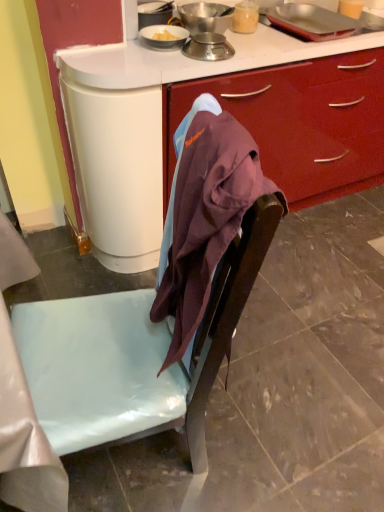
Locate an element on the screen. The width and height of the screenshot is (384, 512). metallic silver scale at upper center, placed as the 3th kitchen appliance when sorted from right to left is located at coordinates tap(205, 17).

What do you see at coordinates (133, 355) in the screenshot?
I see `matte brown chair at center` at bounding box center [133, 355].

Find the location of a particular element. Image resolution: width=384 pixels, height=512 pixels. metallic silver scale at upper center, which appears as the 2th kitchen appliance when viewed from the left is located at coordinates (208, 47).

The height and width of the screenshot is (512, 384). Describe the element at coordinates (311, 21) in the screenshot. I see `metallic silver tray at upper right, which appears as the first kitchen appliance when viewed from the right` at that location.

The height and width of the screenshot is (512, 384). I want to click on metallic silver scale at upper center, the first kitchen appliance in the left-to-right sequence, so click(205, 17).

Can you confirm if metallic silver scale at upper center, which appears as the 2th kitchen appliance when viewed from the left, is wider than metallic silver scale at upper center, the first kitchen appliance in the left-to-right sequence?

Incorrect, the width of metallic silver scale at upper center, which appears as the 2th kitchen appliance when viewed from the left, does not surpass that of metallic silver scale at upper center, the first kitchen appliance in the left-to-right sequence.

From the image's perspective, is metallic silver scale at upper center, which appears as the 2th kitchen appliance when viewed from the left, beneath metallic silver scale at upper center, the first kitchen appliance in the left-to-right sequence?

Correct, metallic silver scale at upper center, which appears as the 2th kitchen appliance when viewed from the left, appears lower than metallic silver scale at upper center, the first kitchen appliance in the left-to-right sequence, in the image.

Would you say metallic silver scale at upper center, placed as the 3th kitchen appliance when sorted from right to left, is part of metallic silver scale at upper center, the 2th kitchen appliance positioned from the right,'s contents?

No, metallic silver scale at upper center, placed as the 3th kitchen appliance when sorted from right to left, is located outside of metallic silver scale at upper center, the 2th kitchen appliance positioned from the right.

Who is smaller, metallic silver scale at upper center, which appears as the 2th kitchen appliance when viewed from the left, or metallic silver scale at upper center, the first kitchen appliance in the left-to-right sequence?

metallic silver scale at upper center, which appears as the 2th kitchen appliance when viewed from the left, is smaller.

From the image's perspective, which one is positioned lower, metallic silver scale at upper center, placed as the 3th kitchen appliance when sorted from right to left, or matte brown chair at center?

matte brown chair at center appears lower in the image.

Which object is closer to the camera taking this photo, metallic silver scale at upper center, the first kitchen appliance in the left-to-right sequence, or matte brown chair at center?

matte brown chair at center is more forward.

Can you confirm if metallic silver scale at upper center, placed as the 3th kitchen appliance when sorted from right to left, is thinner than matte brown chair at center?

Correct, the width of metallic silver scale at upper center, placed as the 3th kitchen appliance when sorted from right to left, is less than that of matte brown chair at center.

Could matte brown chair at center be considered to be inside metallic silver scale at upper center, the first kitchen appliance in the left-to-right sequence?

No.

Considering the relative sizes of metallic silver scale at upper center, which appears as the 2th kitchen appliance when viewed from the left, and matte brown chair at center in the image provided, is metallic silver scale at upper center, which appears as the 2th kitchen appliance when viewed from the left, shorter than matte brown chair at center?

No.

Is metallic silver scale at upper center, the 2th kitchen appliance positioned from the right, positioned in front of matte brown chair at center?

That is False.

Between point (207, 42) and point (49, 425), which one is positioned behind?

The point (207, 42) is farther.

Does metallic silver scale at upper center, which appears as the 2th kitchen appliance when viewed from the left, contain matte brown chair at center?

That's incorrect, matte brown chair at center is not inside metallic silver scale at upper center, which appears as the 2th kitchen appliance when viewed from the left.

From the image's perspective, does matte brown chair at center appear lower than metallic silver scale at upper center, which appears as the 2th kitchen appliance when viewed from the left?

Indeed, from the image's perspective, matte brown chair at center is shown beneath metallic silver scale at upper center, which appears as the 2th kitchen appliance when viewed from the left.

Is the surface of matte brown chair at center in direct contact with metallic silver scale at upper center, the 2th kitchen appliance positioned from the right?

No, matte brown chair at center is not touching metallic silver scale at upper center, the 2th kitchen appliance positioned from the right.

Do you think matte brown chair at center is within metallic silver scale at upper center, which appears as the 2th kitchen appliance when viewed from the left, or outside of it?

The correct answer is: outside.

In the scene shown: Is matte brown chair at center facing towards metallic silver scale at upper center, which appears as the 2th kitchen appliance when viewed from the left?

No, matte brown chair at center is not turned towards metallic silver scale at upper center, which appears as the 2th kitchen appliance when viewed from the left.

Does matte brown chair at center come in front of metallic silver tray at upper right, which appears as the first kitchen appliance when viewed from the right?

Yes, it is in front of metallic silver tray at upper right, which appears as the first kitchen appliance when viewed from the right.

Considering the relative sizes of matte brown chair at center and metallic silver tray at upper right, positioned as the 3th kitchen appliance in left-to-right order, in the image provided, is matte brown chair at center smaller than metallic silver tray at upper right, positioned as the 3th kitchen appliance in left-to-right order,?

No.

From the image's perspective, is matte brown chair at center under metallic silver tray at upper right, positioned as the 3th kitchen appliance in left-to-right order?

Yes.

Is matte brown chair at center looking in the opposite direction of metallic silver tray at upper right, positioned as the 3th kitchen appliance in left-to-right order?

That's not correct — matte brown chair at center is not looking away from metallic silver tray at upper right, positioned as the 3th kitchen appliance in left-to-right order.

From the image's perspective, which one is positioned lower, metallic silver tray at upper right, which appears as the first kitchen appliance when viewed from the right, or metallic silver scale at upper center, the 2th kitchen appliance positioned from the right?

From the image's view, metallic silver scale at upper center, the 2th kitchen appliance positioned from the right, is below.

Are metallic silver tray at upper right, positioned as the 3th kitchen appliance in left-to-right order, and metallic silver scale at upper center, which appears as the 2th kitchen appliance when viewed from the left, far apart?

No, metallic silver tray at upper right, positioned as the 3th kitchen appliance in left-to-right order, is not far from metallic silver scale at upper center, which appears as the 2th kitchen appliance when viewed from the left.

Is matte brown chair at center next to metallic silver scale at upper center, placed as the 3th kitchen appliance when sorted from right to left, and touching it?

No, matte brown chair at center is not with metallic silver scale at upper center, placed as the 3th kitchen appliance when sorted from right to left.

From the image's perspective, is matte brown chair at center on top of metallic silver scale at upper center, the first kitchen appliance in the left-to-right sequence?

No, from the image's perspective, matte brown chair at center is not above metallic silver scale at upper center, the first kitchen appliance in the left-to-right sequence.

Is matte brown chair at center looking in the opposite direction of metallic silver scale at upper center, the first kitchen appliance in the left-to-right sequence?

matte brown chair at center does not have its back to metallic silver scale at upper center, the first kitchen appliance in the left-to-right sequence.

Which of these two, matte brown chair at center or metallic silver scale at upper center, placed as the 3th kitchen appliance when sorted from right to left, stands taller?

metallic silver scale at upper center, placed as the 3th kitchen appliance when sorted from right to left, is taller.

This screenshot has width=384, height=512. I want to click on kitchen appliance that is in front of the metallic silver scale at upper center, the first kitchen appliance in the left-to-right sequence, so click(208, 47).

What are the coordinates of `the 2nd kitchen appliance behind the matte brown chair at center, counting from the anchor's position` in the screenshot? It's located at (205, 17).

From the image, which object appears to be farther from metallic silver tray at upper right, positioned as the 3th kitchen appliance in left-to-right order, metallic silver scale at upper center, which appears as the 2th kitchen appliance when viewed from the left, or metallic silver scale at upper center, the first kitchen appliance in the left-to-right sequence?

Among the two, metallic silver scale at upper center, which appears as the 2th kitchen appliance when viewed from the left, is located further to metallic silver tray at upper right, positioned as the 3th kitchen appliance in left-to-right order.

Looking at the image, which one is located closer to matte brown chair at center, metallic silver scale at upper center, the 2th kitchen appliance positioned from the right, or metallic silver scale at upper center, placed as the 3th kitchen appliance when sorted from right to left?

Among the two, metallic silver scale at upper center, the 2th kitchen appliance positioned from the right, is located nearer to matte brown chair at center.

Based on their spatial positions, is metallic silver tray at upper right, which appears as the first kitchen appliance when viewed from the right, or metallic silver scale at upper center, the 2th kitchen appliance positioned from the right, closer to metallic silver scale at upper center, placed as the 3th kitchen appliance when sorted from right to left?

metallic silver scale at upper center, the 2th kitchen appliance positioned from the right, lies closer to metallic silver scale at upper center, placed as the 3th kitchen appliance when sorted from right to left, than the other object.

Looking at the image, which one is located further to metallic silver scale at upper center, placed as the 3th kitchen appliance when sorted from right to left, matte brown chair at center or metallic silver scale at upper center, the 2th kitchen appliance positioned from the right?

matte brown chair at center.

Considering their positions, is metallic silver scale at upper center, placed as the 3th kitchen appliance when sorted from right to left, positioned closer to matte brown chair at center than metallic silver scale at upper center, the 2th kitchen appliance positioned from the right?

metallic silver scale at upper center, the 2th kitchen appliance positioned from the right, is positioned closer to the anchor matte brown chair at center.

Considering their positions, is metallic silver tray at upper right, which appears as the first kitchen appliance when viewed from the right, positioned further to metallic silver scale at upper center, which appears as the 2th kitchen appliance when viewed from the left, than metallic silver scale at upper center, placed as the 3th kitchen appliance when sorted from right to left?

Among the two, metallic silver tray at upper right, which appears as the first kitchen appliance when viewed from the right, is located further to metallic silver scale at upper center, which appears as the 2th kitchen appliance when viewed from the left.

Which object lies nearer to the anchor point metallic silver scale at upper center, the first kitchen appliance in the left-to-right sequence, metallic silver scale at upper center, which appears as the 2th kitchen appliance when viewed from the left, or matte brown chair at center?

metallic silver scale at upper center, which appears as the 2th kitchen appliance when viewed from the left, is closer to metallic silver scale at upper center, the first kitchen appliance in the left-to-right sequence.

Which object lies further to the anchor point matte brown chair at center, metallic silver tray at upper right, positioned as the 3th kitchen appliance in left-to-right order, or metallic silver scale at upper center, the first kitchen appliance in the left-to-right sequence?

metallic silver tray at upper right, positioned as the 3th kitchen appliance in left-to-right order, is further to matte brown chair at center.

At what (x,y) coordinates should I click in order to perform the action: click on kitchen appliance between metallic silver scale at upper center, the first kitchen appliance in the left-to-right sequence, and matte brown chair at center in the up-down direction. Please return your answer as a coordinate pair (x, y). The height and width of the screenshot is (512, 384). Looking at the image, I should click on (208, 47).

Locate an element on the screen. The height and width of the screenshot is (512, 384). kitchen appliance located between metallic silver scale at upper center, the first kitchen appliance in the left-to-right sequence, and metallic silver tray at upper right, positioned as the 3th kitchen appliance in left-to-right order, in the left-right direction is located at coordinates (208, 47).